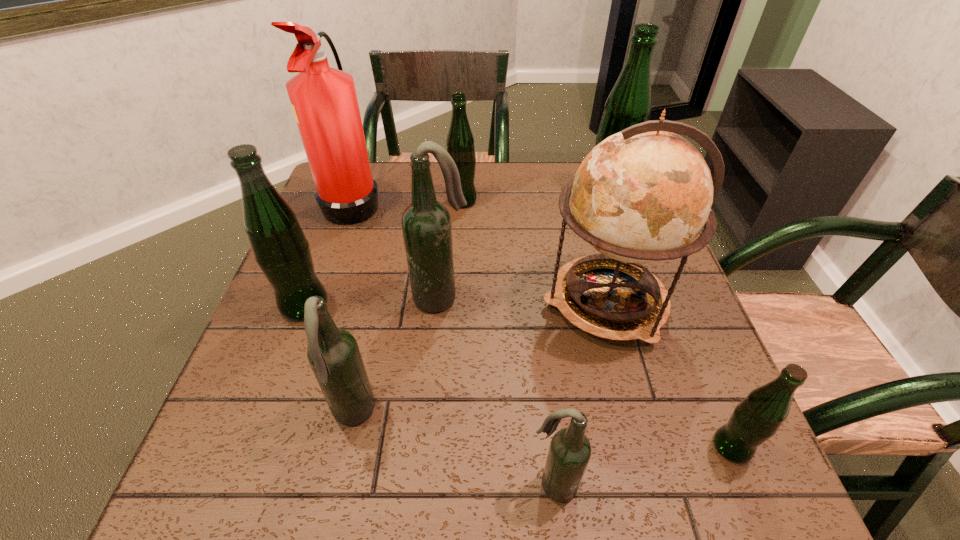
Find the location of `free space between the nearest object and the second dark beer bottle from right to left`. free space between the nearest object and the second dark beer bottle from right to left is located at coordinates (497, 392).

You are a GUI agent. You are given a task and a screenshot of the screen. Output one action in this format:
    pyautogui.click(x=<x>, y=<y>)
    Task: Click on the empty space between the third beer bottle from right to left and the third green beer bottle from right to left
    This screenshot has height=540, width=960.
    Given the screenshot: What is the action you would take?
    pyautogui.click(x=508, y=342)

At what (x,y) coordinates should I click in order to perform the action: click on free space between the seventh object from right to left and the nearest dark beer bottle. Please return your answer as a coordinate pair (x, y). This screenshot has height=540, width=960. Looking at the image, I should click on (453, 450).

At what (x,y) coordinates should I click in order to perform the action: click on vacant space in between the fifth beer bottle from left to right and the globe. Please return your answer as a coordinate pair (x, y). Looking at the image, I should click on (580, 394).

Find the location of a particular element. The width and height of the screenshot is (960, 540). free space between the red fire extinguisher and the farthest dark beer bottle is located at coordinates (397, 250).

Locate an element on the screen. the second closest object to the globe is located at coordinates (426, 224).

Where is `object that is the eighth closest to the globe`? object that is the eighth closest to the globe is located at coordinates (280, 248).

Identify which beer bottle is the second nearest to the nearest dark beer bottle. Please provide its 2D coordinates. Your answer should be formatted as a tuple, i.e. [(x, y)], where the tuple contains the x and y coordinates of a point satisfying the conditions above.

[(333, 354)]

Find the location of a particular element. This screenshot has height=540, width=960. beer bottle that is the third closest one to the nearest object is located at coordinates (426, 224).

Find the location of a particular element. green beer bottle that can be found as the second closest to the nearest green beer bottle is located at coordinates (460, 142).